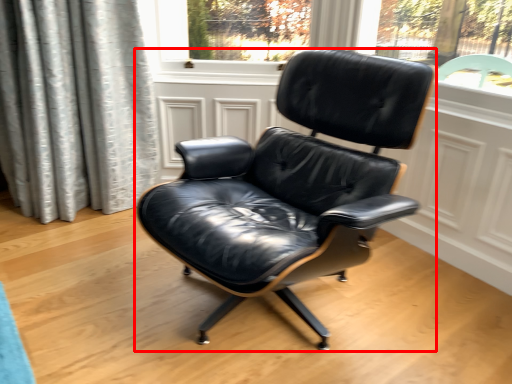
Question: In this image, where is chair (annotated by the red box) located relative to screen door?

Choices:
 (A) right
 (B) left

Answer: (A)